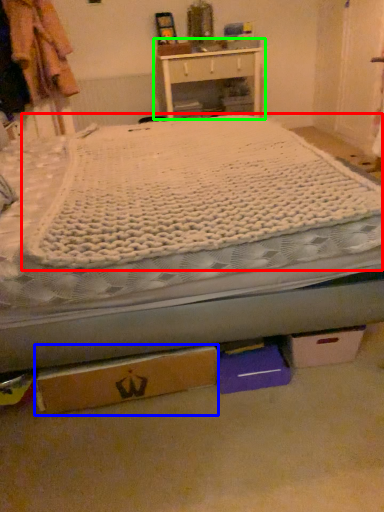
Question: Which object is the closest to the mattress (highlighted by a red box)? Choose among these: cardboard box (highlighted by a blue box) or nightstand (highlighted by a green box).

Choices:
 (A) cardboard box
 (B) nightstand

Answer: (A)